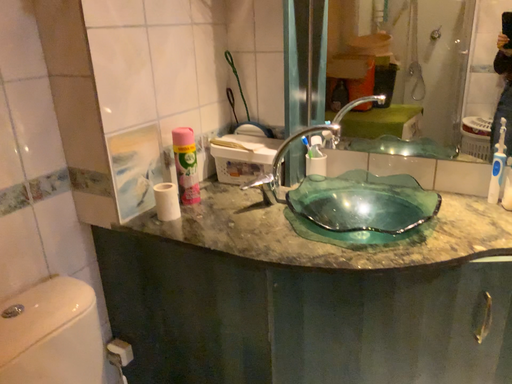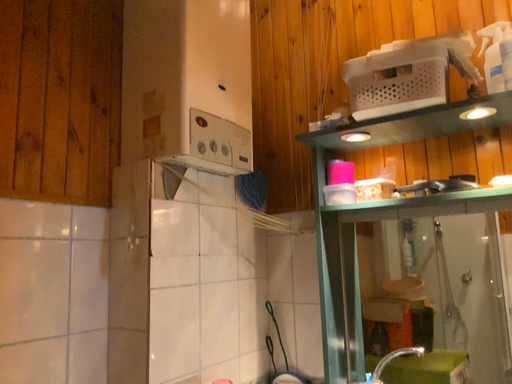
Question: How did the camera likely rotate when shooting the video?

Choices:
 (A) rotated downward
 (B) rotated upward

Answer: (B)